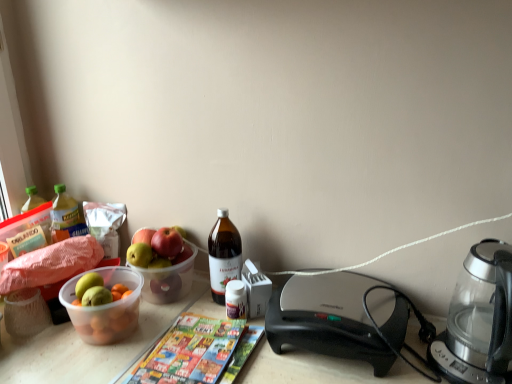
What do you see at coordinates (327, 319) in the screenshot?
I see `black plastic sandwich maker at center` at bounding box center [327, 319].

Describe the element at coordinates (479, 319) in the screenshot. I see `transparent glass coffee maker at right` at that location.

I want to click on multicolored glossy magazine at center, so [190, 352].

Locate an element on the screen. translucent plastic bowl at left is located at coordinates (106, 308).

Identify the location of black plastic sandwich maker at center. This screenshot has width=512, height=384. point(327,319).

Looking at this image, is transparent glass coffee maker at right facing towards translucent plastic bottle at left, positioned as the 1th bottle in left-to-right order?

No, transparent glass coffee maker at right is not turned towards translucent plastic bottle at left, positioned as the 1th bottle in left-to-right order.

Where is `coffee maker on the right of the translucent plastic bottle at left, the first bottle from the back`? The width and height of the screenshot is (512, 384). coffee maker on the right of the translucent plastic bottle at left, the first bottle from the back is located at coordinates (479, 319).

From the image's perspective, is transparent glass coffee maker at right located beneath translucent plastic bottle at left, positioned as the 1th bottle in left-to-right order?

Indeed, from the image's perspective, transparent glass coffee maker at right is shown beneath translucent plastic bottle at left, positioned as the 1th bottle in left-to-right order.

Is transparent glass coffee maker at right thinner than translucent plastic bottle at left, the first bottle from the back?

In fact, transparent glass coffee maker at right might be wider than translucent plastic bottle at left, the first bottle from the back.

Is transparent glass coffee maker at right at the right side of multicolored glossy magazine at center?

Yes, transparent glass coffee maker at right is to the right of multicolored glossy magazine at center.

Looking at their sizes, would you say transparent glass coffee maker at right is wider or thinner than multicolored glossy magazine at center?

Clearly, transparent glass coffee maker at right has less width compared to multicolored glossy magazine at center.

From a real-world perspective, is transparent glass coffee maker at right physically located above or below multicolored glossy magazine at center?

Clearly, from a real-world perspective, transparent glass coffee maker at right is above multicolored glossy magazine at center.

Is transparent glass coffee maker at right to the right of black plastic sandwich maker at center from the viewer's perspective?

Correct, you'll find transparent glass coffee maker at right to the right of black plastic sandwich maker at center.

Is transparent glass coffee maker at right outside of black plastic sandwich maker at center?

transparent glass coffee maker at right lies outside black plastic sandwich maker at center's area.

Is transparent glass coffee maker at right wider or thinner than black plastic sandwich maker at center?

In the image, transparent glass coffee maker at right appears to be more narrow than black plastic sandwich maker at center.

Looking at this image, considering the relative sizes of translucent plastic bottle at left, the first bottle from the back, and translucent plastic bowl at left in the image provided, is translucent plastic bottle at left, the first bottle from the back, bigger than translucent plastic bowl at left?

No.

Is translucent plastic bottle at left, positioned as the 1th bottle in left-to-right order, inside the boundaries of translucent plastic bowl at left, or outside?

translucent plastic bottle at left, positioned as the 1th bottle in left-to-right order, is outside translucent plastic bowl at left.

Considering the points (67, 233) and (75, 311), which point is behind, point (67, 233) or point (75, 311)?

Positioned behind is point (67, 233).

In terms of height, does multicolored glossy magazine at center look taller or shorter compared to translucent plastic bottle at left, the 2th bottle positioned from the right?

multicolored glossy magazine at center is shorter than translucent plastic bottle at left, the 2th bottle positioned from the right.

Between multicolored glossy magazine at center and translucent plastic bottle at left, positioned as the 1th bottle in left-to-right order, which one has smaller size?

translucent plastic bottle at left, positioned as the 1th bottle in left-to-right order, is smaller.

From the image's perspective, is multicolored glossy magazine at center positioned above or below translucent plastic bottle at left, the 2th bottle positioned from the right?

From the image's perspective, multicolored glossy magazine at center appears below translucent plastic bottle at left, the 2th bottle positioned from the right.

Consider the image. Are multicolored glossy magazine at center and translucent plastic bottle at left, the second bottle viewed from the front, far apart?

That's not correct — multicolored glossy magazine at center is a little close to translucent plastic bottle at left, the second bottle viewed from the front.

Which object is wider, translucent plastic bowl at left or translucent plastic bottle at left, positioned as the 1th bottle in left-to-right order?

With larger width is translucent plastic bowl at left.

Is translucent plastic bowl at left not within translucent plastic bottle at left, positioned as the 1th bottle in left-to-right order?

Yes, translucent plastic bowl at left is outside of translucent plastic bottle at left, positioned as the 1th bottle in left-to-right order.

Is point (94, 318) farther from viewer compared to point (63, 217)?

No, it is not.

Find the location of a particular element. This screenshot has height=384, width=512. bowl that appears below the translucent plastic bottle at left, positioned as the 1th bottle in left-to-right order (from a real-world perspective) is located at coordinates (106, 308).

Where is `coffee maker above the translucent plastic bowl at left (from a real-world perspective)`? The image size is (512, 384). coffee maker above the translucent plastic bowl at left (from a real-world perspective) is located at coordinates (479, 319).

Does transparent glass coffee maker at right have a lesser width compared to translucent plastic bowl at left?

No.

Is transparent glass coffee maker at right smaller than translucent plastic bowl at left?

No.

From the image's perspective, is transparent glass coffee maker at right located above or below translucent plastic bowl at left?

transparent glass coffee maker at right is situated lower than translucent plastic bowl at left in the image.

Identify the location of bottle above the transparent glass coffee maker at right (from a real-world perspective). This screenshot has width=512, height=384. (66, 216).

Where is `magazine below the transparent glass coffee maker at right (from a real-world perspective)`? The width and height of the screenshot is (512, 384). magazine below the transparent glass coffee maker at right (from a real-world perspective) is located at coordinates (190, 352).

Considering their positions, is transparent glass coffee maker at right positioned further to translucent glass bottle at center, the first bottle viewed from the front, than multicolored glossy magazine at center?

transparent glass coffee maker at right lies further to translucent glass bottle at center, the first bottle viewed from the front, than the other object.

Looking at the image, which one is located closer to translucent plastic bowl at left, transparent glass coffee maker at right or translucent plastic bottle at left, positioned as the 1th bottle in left-to-right order?

The object closer to translucent plastic bowl at left is translucent plastic bottle at left, positioned as the 1th bottle in left-to-right order.

From the image, which object appears to be farther from translucent plastic bowl at left, translucent glass bottle at center, the first bottle viewed from the front, or multicolored glossy magazine at center?

Among the two, translucent glass bottle at center, the first bottle viewed from the front, is located further to translucent plastic bowl at left.

Estimate the real-world distances between objects in this image. Which object is further from translucent plastic bowl at left, multicolored glossy magazine at center or translucent glass bottle at center, the first bottle viewed from the front?

translucent glass bottle at center, the first bottle viewed from the front.

Which object lies nearer to the anchor point black plastic sandwich maker at center, translucent plastic bowl at left or translucent plastic bottle at left, the first bottle from the back?

Based on the image, translucent plastic bowl at left appears to be nearer to black plastic sandwich maker at center.

Estimate the real-world distances between objects in this image. Which object is closer to translucent plastic bottle at left, the 2th bottle positioned from the right, black plastic sandwich maker at center or translucent glass bottle at center, positioned as the 2th bottle in left-to-right order?

translucent glass bottle at center, positioned as the 2th bottle in left-to-right order, is closer to translucent plastic bottle at left, the 2th bottle positioned from the right.

From the image, which object appears to be farther from multicolored glossy magazine at center, translucent plastic bottle at left, positioned as the 1th bottle in left-to-right order, or black plastic sandwich maker at center?

translucent plastic bottle at left, positioned as the 1th bottle in left-to-right order, is positioned further to the anchor multicolored glossy magazine at center.

Considering their positions, is transparent glass coffee maker at right positioned further to multicolored glossy magazine at center than translucent glass bottle at center, the first bottle viewed from the front?

Among the two, transparent glass coffee maker at right is located further to multicolored glossy magazine at center.

Identify the location of magazine between translucent plastic bottle at left, the 2th bottle positioned from the right, and translucent glass bottle at center, which is the first bottle in right-to-left order. The width and height of the screenshot is (512, 384). (190, 352).

Find the location of a particular element. This screenshot has height=384, width=512. appliance situated between translucent plastic bowl at left and transparent glass coffee maker at right from left to right is located at coordinates (327, 319).

Where is `bottle between translucent plastic bottle at left, the second bottle viewed from the front, and transparent glass coffee maker at right from left to right`? bottle between translucent plastic bottle at left, the second bottle viewed from the front, and transparent glass coffee maker at right from left to right is located at coordinates (223, 255).

Locate an element on the screen. bowl between translucent plastic bottle at left, the first bottle from the back, and black plastic sandwich maker at center is located at coordinates (106, 308).